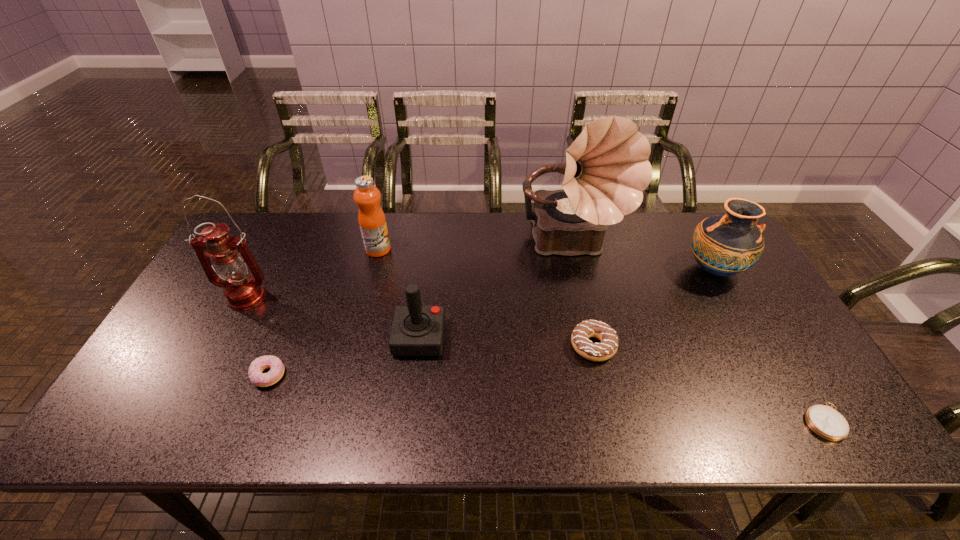
Find the location of a particular element. compass is located at coordinates (823, 420).

Find the location of `the nearest object`. the nearest object is located at coordinates (823, 420).

Locate an element on the screen. vacant area located 0.180m from the horn of the record player is located at coordinates (593, 330).

Locate an element on the screen. free space located 0.150m on the right of the second tallest object is located at coordinates (324, 298).

Where is `vacant space located on the left of the third object from left to right`? The width and height of the screenshot is (960, 540). vacant space located on the left of the third object from left to right is located at coordinates (287, 249).

Locate an element on the screen. The width and height of the screenshot is (960, 540). free spot located on the left of the pottery is located at coordinates (666, 270).

Where is `free space located on the base of the fourth object from left to right`? free space located on the base of the fourth object from left to right is located at coordinates (482, 338).

The height and width of the screenshot is (540, 960). I want to click on free space located 0.380m on the left of the right doughnut, so click(x=423, y=346).

Locate an element on the screen. This screenshot has width=960, height=540. vacant area located on the back of the shorter doughnut is located at coordinates (306, 284).

Find the location of a particular element. The height and width of the screenshot is (540, 960). vacant space situated 0.210m on the back of the nearest object is located at coordinates (770, 332).